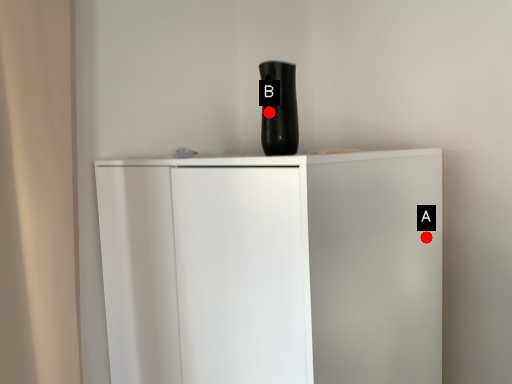
Question: Two points are circled on the image, labeled by A and B beside each circle. Which point is closer to the camera?

Choices:
 (A) A is closer
 (B) B is closer

Answer: (B)